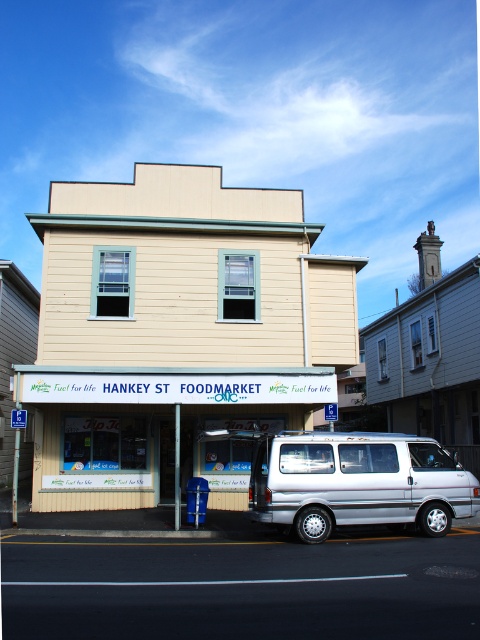
Question: Which object appears farthest from the camera in this image?

Choices:
 (A) beige wood hankey st foodmarket at center
 (B) silver metallic van at center

Answer: (A)

Question: Which of the following is the closest to the observer?

Choices:
 (A) (x=331, y=477)
 (B) (x=143, y=337)

Answer: (A)

Question: Does beige wood hankey st foodmarket at center have a lesser width compared to silver metallic van at center?

Choices:
 (A) no
 (B) yes

Answer: (A)

Question: Is beige wood hankey st foodmarket at center closer to camera compared to silver metallic van at center?

Choices:
 (A) yes
 (B) no

Answer: (B)

Question: Is beige wood hankey st foodmarket at center above silver metallic van at center?

Choices:
 (A) yes
 (B) no

Answer: (A)